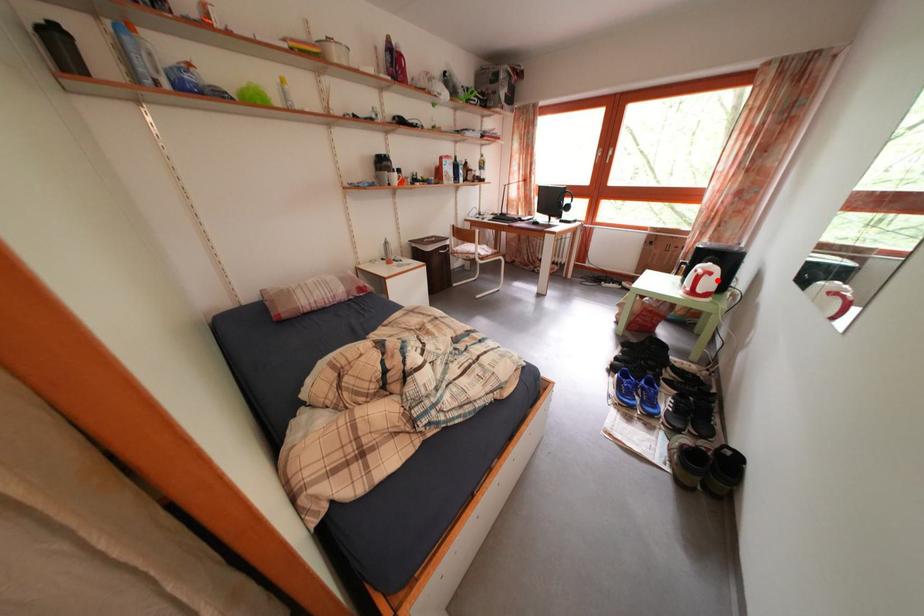
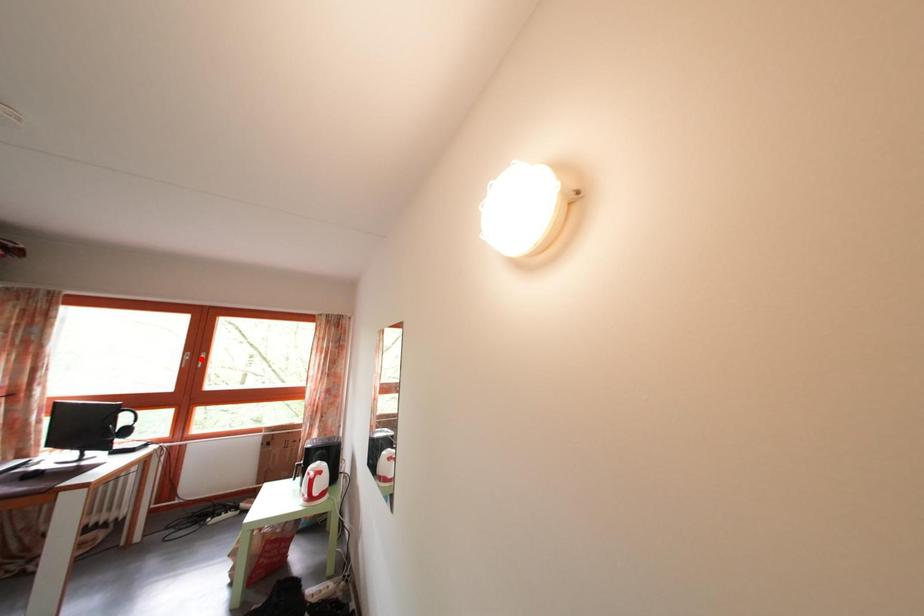
I am providing you with two images of the same scene from different viewpoints. A red point is marked on the first image and another point is marked on the second image. Does the point marked in image1 correspond to the same location as the one in image2?

No